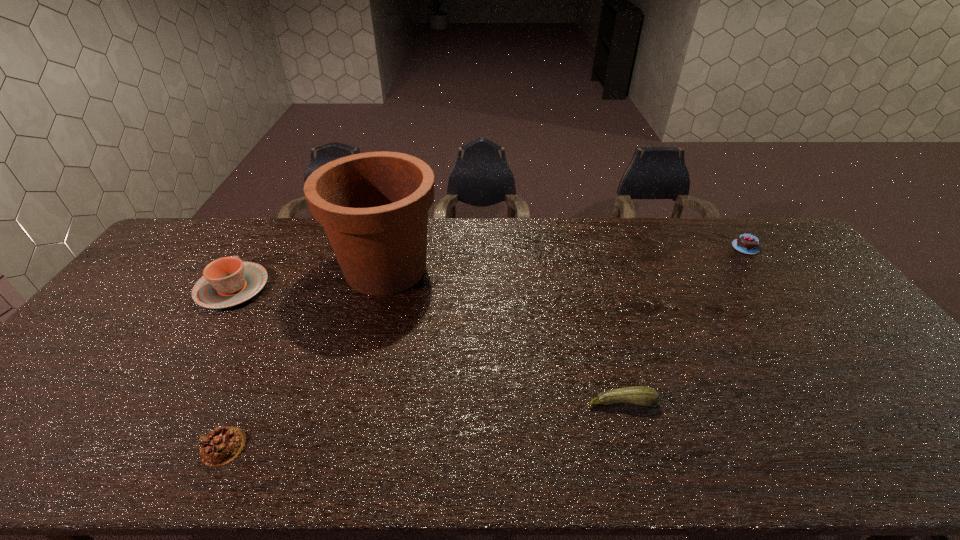
You are a GUI agent. You are given a task and a screenshot of the screen. Output one action in this format:
    pyautogui.click(x=<x>, y=<y>)
    Task: Click on the free region located 0.150m on the right of the third object from right to left
    Image resolution: width=960 pixels, height=540 pixels.
    Given the screenshot: What is the action you would take?
    pyautogui.click(x=487, y=269)

Find the location of a particular element. The width and height of the screenshot is (960, 540). free space located on the handle side of the second tallest object is located at coordinates (274, 223).

Locate an element on the screen. This screenshot has width=960, height=540. free spot located 0.080m on the handle side of the second tallest object is located at coordinates (255, 251).

I want to click on vacant area situated on the handle side of the second tallest object, so click(264, 238).

Locate an element on the screen. This screenshot has width=960, height=540. vacant space situated on the left of the rightmost object is located at coordinates (648, 247).

Where is `free location located at the stem end of the zucchini`? This screenshot has height=540, width=960. free location located at the stem end of the zucchini is located at coordinates (636, 456).

I want to click on vacant point located 0.080m on the right of the nearest object, so (x=281, y=447).

You are a GUI agent. You are given a task and a screenshot of the screen. Output one action in this format:
    pyautogui.click(x=<x>, y=<y>)
    Task: Click on the flowerpot at the far edge
    
    Given the screenshot: What is the action you would take?
    pyautogui.click(x=373, y=206)

The height and width of the screenshot is (540, 960). In order to click on chocolate cake positioned at the far edge in this screenshot , I will do `click(746, 243)`.

What are the coordinates of `object at the near edge` in the screenshot? It's located at (221, 446).